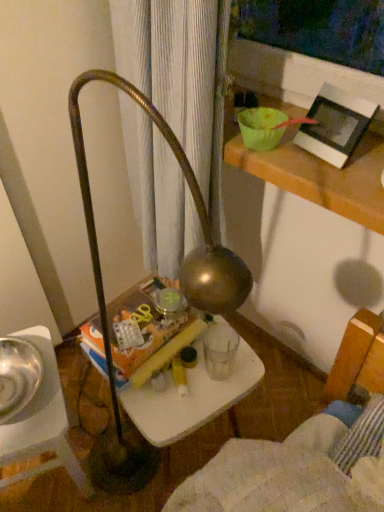
Question: Is shiny metallic bowl at left bigger or smaller than white plastic table at center?

Choices:
 (A) big
 (B) small

Answer: (B)

Question: From the image's perspective, is shiny metallic bowl at left positioned above or below white plastic table at center?

Choices:
 (A) below
 (B) above

Answer: (B)

Question: Estimate the real-world distances between objects in this image. Which object is farther from the metallic silver bowl at lower left?

Choices:
 (A) shiny metallic bowl at left
 (B) white plastic table at center
 (C) white matte picture frame at upper right

Answer: (C)

Question: Based on their relative distances, which object is nearer to the white plastic table at center?

Choices:
 (A) white matte picture frame at upper right
 (B) metallic silver bowl at lower left
 (C) shiny metallic bowl at left

Answer: (B)